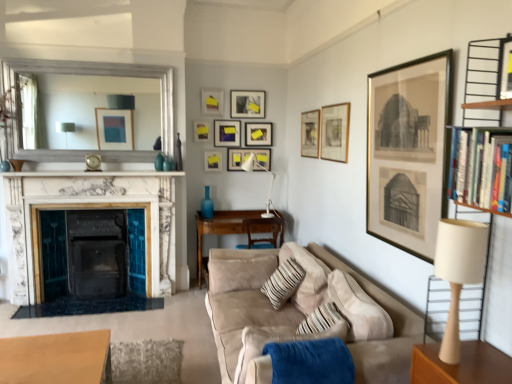
Question: Considering the relative positions of gold-framed print at upper right, which appears as the tenth picture frame when viewed from the back, and matte gold picture frame at upper center, the 3th picture frame in the front-to-back sequence, in the image provided, is gold-framed print at upper right, which appears as the tenth picture frame when viewed from the back, to the left or to the right of matte gold picture frame at upper center, the 3th picture frame in the front-to-back sequence,?

Choices:
 (A) left
 (B) right

Answer: (B)

Question: From a real-world perspective, relative to matte gold picture frame at upper center, the 3th picture frame in the front-to-back sequence, is gold-framed print at upper right, which appears as the tenth picture frame when viewed from the back, vertically above or below?

Choices:
 (A) below
 (B) above

Answer: (A)

Question: Which object is the farthest from the gold-framed print at upper right, which appears as the tenth picture frame when viewed from the back?

Choices:
 (A) matte black picture frame at upper center, the 5th picture frame positioned from the back
 (B) matte yellow picture frame at upper center, marked as the fourth picture frame in a back-to-front arrangement
 (C) brown wooden table at center, the 2th table positioned from the front
 (D) striped fabric pillow at center
 (E) white metal table lamp at center, positioned as the 2th table lamp in right-to-left order

Answer: (E)

Question: Based on their relative distances, which object is nearer to the white marble fireplace at left?

Choices:
 (A) matte black picture frame at upper center, positioned as the sixth picture frame in front-to-back order
 (B) brown wooden table at center, the 1th table viewed from the top
 (C) gold-framed print at upper right, the 1th picture frame viewed from the front
 (D) matte gold picture frame at upper right, marked as the 9th picture frame in a back-to-front arrangement
 (E) blue soft fabric blanket at lower center

Answer: (B)